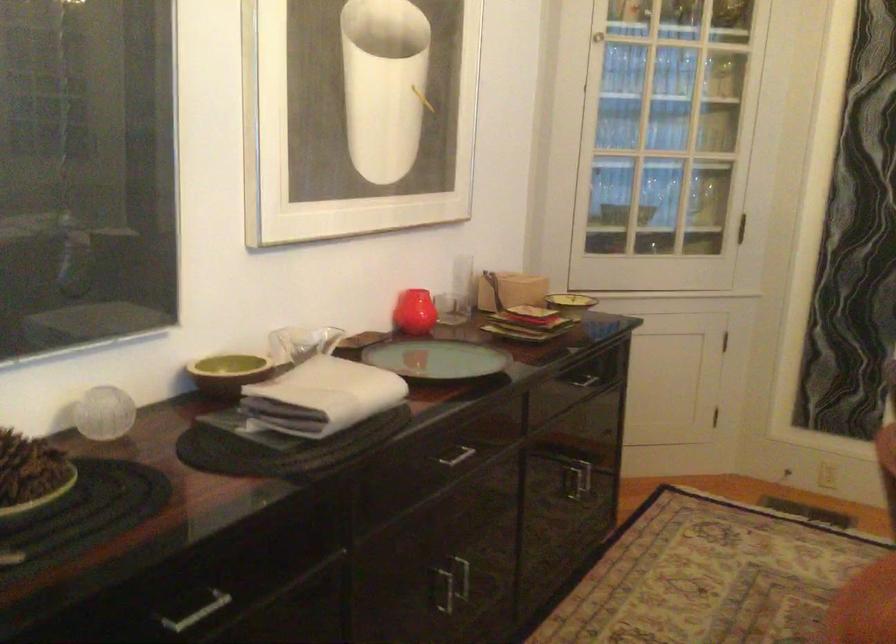
What do you see at coordinates (597, 37) in the screenshot?
I see `the small cabinet knob` at bounding box center [597, 37].